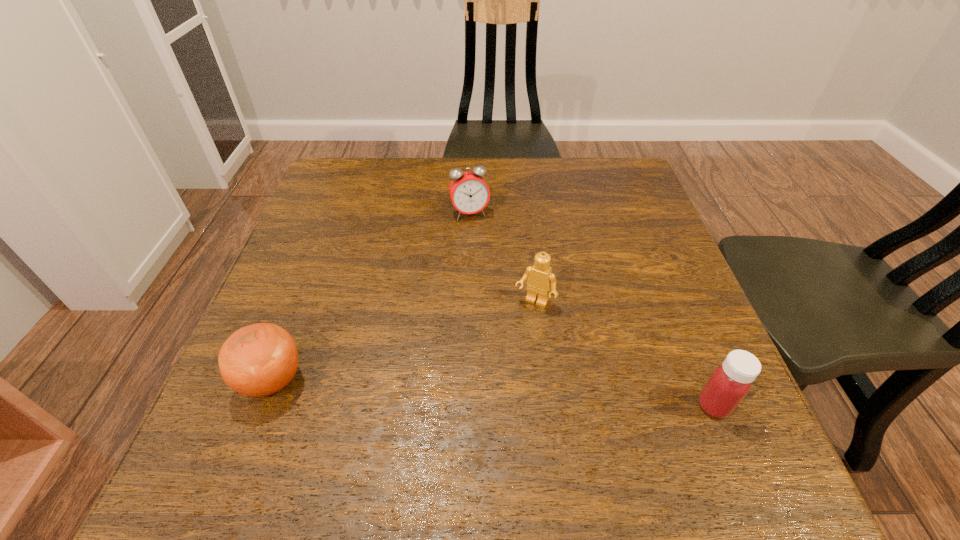
Identify the location of orange. The width and height of the screenshot is (960, 540). (257, 360).

Locate an element on the screen. The height and width of the screenshot is (540, 960). medicine is located at coordinates (730, 382).

This screenshot has width=960, height=540. In order to click on Lego in this screenshot , I will do `click(540, 278)`.

You are a GUI agent. You are given a task and a screenshot of the screen. Output one action in this format:
    pyautogui.click(x=<x>, y=<y>)
    Task: Click on the third object from left to right
    This screenshot has height=540, width=960.
    Given the screenshot: What is the action you would take?
    pyautogui.click(x=540, y=278)

I want to click on the farthest object, so click(469, 193).

At what (x,y) coordinates should I click in order to perform the action: click on the third object from right to left. Please return your answer as a coordinate pair (x, y). The image size is (960, 540). Looking at the image, I should click on (469, 193).

Where is `free space located 0.390m on the back of the leftmost object`? free space located 0.390m on the back of the leftmost object is located at coordinates (333, 223).

Image resolution: width=960 pixels, height=540 pixels. Identify the location of free space located on the left of the medicine. (657, 406).

The image size is (960, 540). Find the location of `free location located 0.220m on the face of the third object from left to right`. free location located 0.220m on the face of the third object from left to right is located at coordinates (479, 400).

Identify the location of free space located on the face of the third object from left to right. (501, 360).